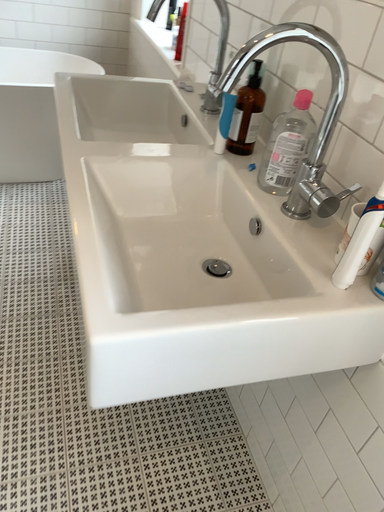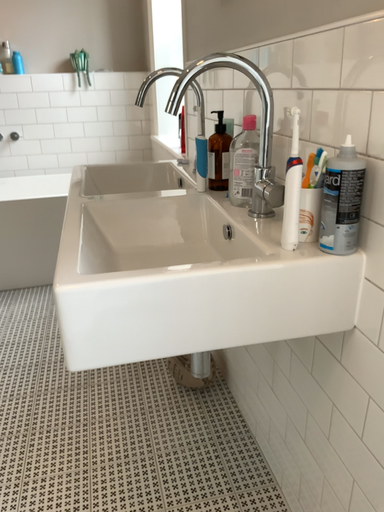
Question: How did the camera likely rotate when shooting the video?

Choices:
 (A) rotated right
 (B) rotated left

Answer: (B)